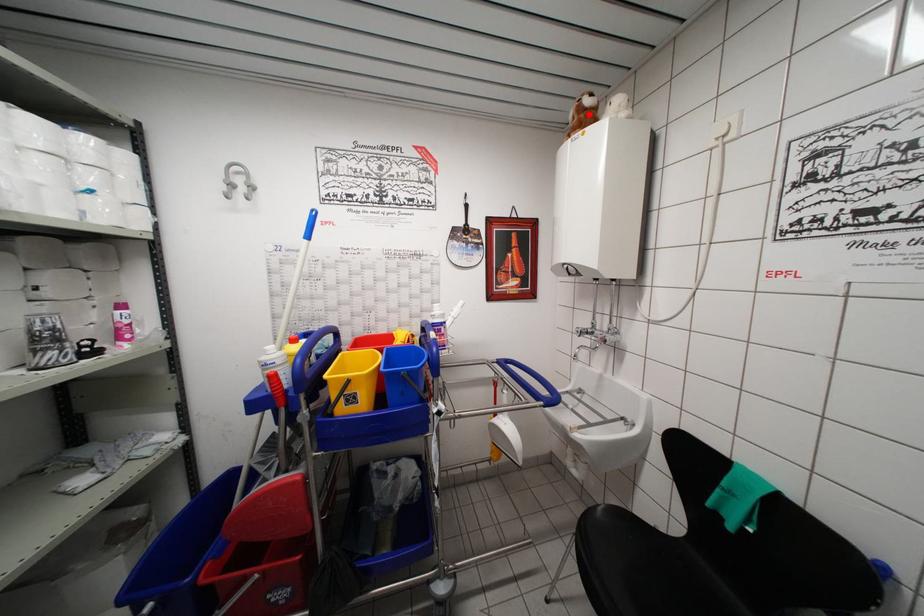
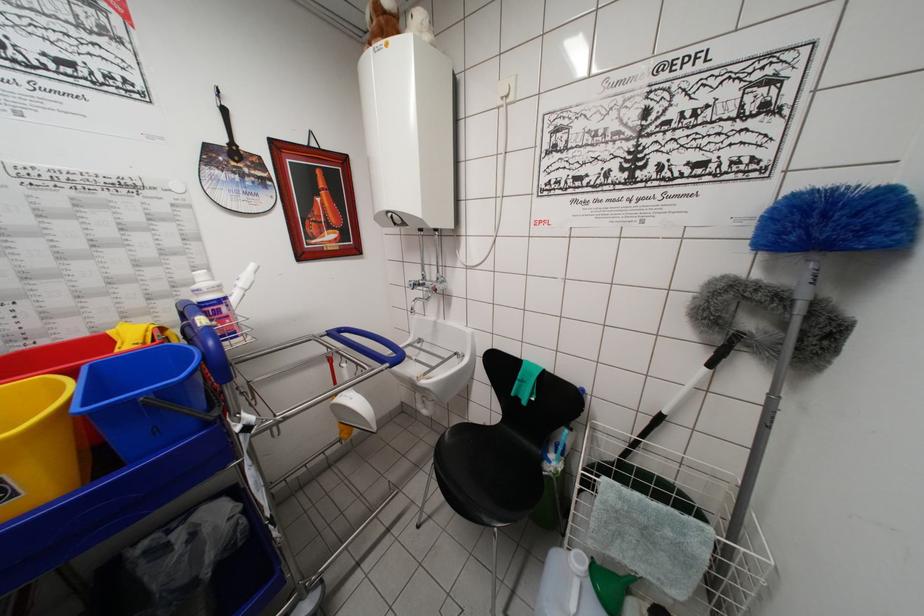
Where in the second image is the point corresponding to the highlighted location from the first image?

(387, 17)